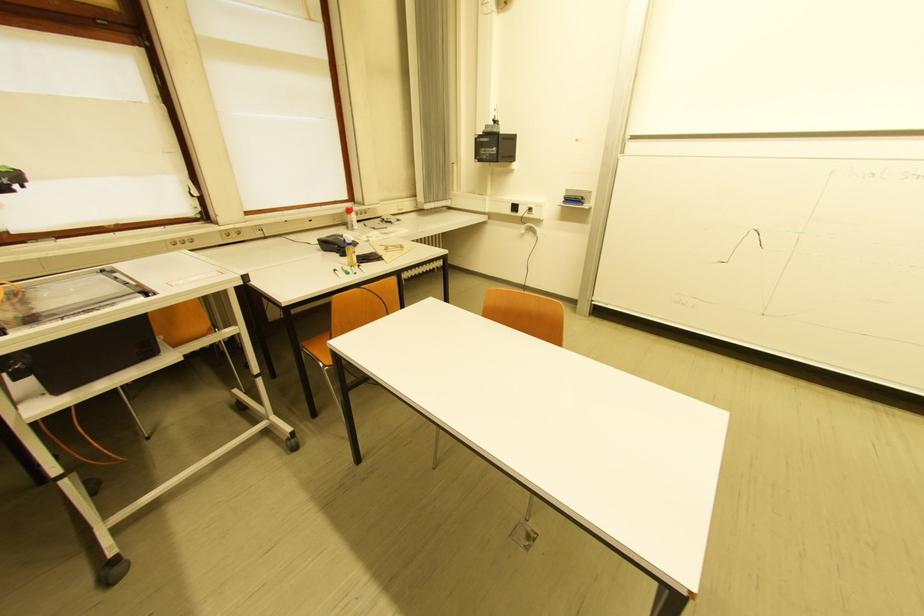
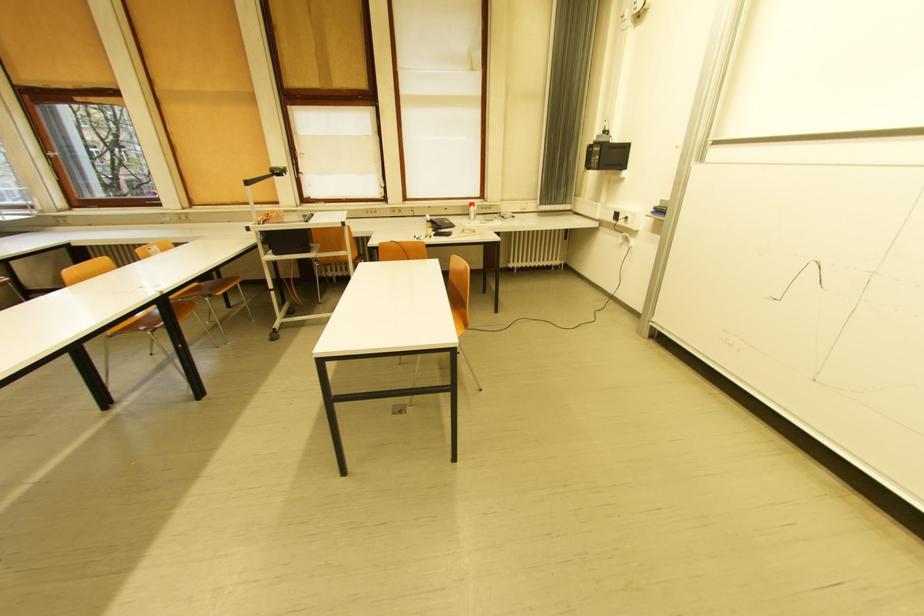
Question: I am providing you with two images of the same scene from different viewpoints. Which of the following objects are not visible in image2?

Choices:
 (A) sewing machine cover
 (B) projector head
 (C) orange chair surface
 (D) red and white bottle

Answer: (C)